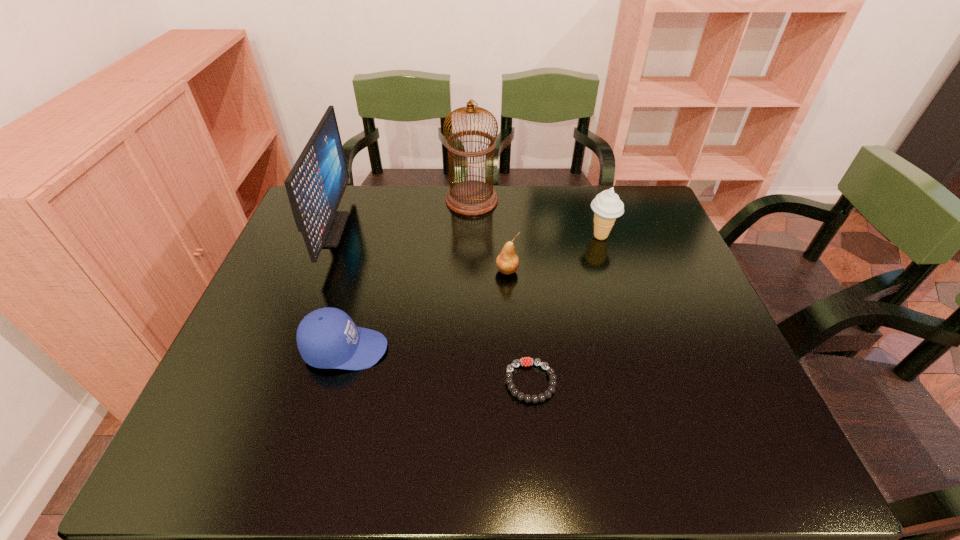
At what (x,y) coordinates should I click in order to perform the action: click on free location that satisfies the following two spatial constraints: 1. on the back side of the shortest object; 2. on the screen side of the leftmost object. Please return your answer as a coordinate pair (x, y). The width and height of the screenshot is (960, 540). Looking at the image, I should click on (516, 230).

Where is `free space that satisfies the following two spatial constraints: 1. on the front-facing side of the pear; 2. on the left side of the birdcage`? This screenshot has height=540, width=960. free space that satisfies the following two spatial constraints: 1. on the front-facing side of the pear; 2. on the left side of the birdcage is located at coordinates (470, 271).

You are a GUI agent. You are given a task and a screenshot of the screen. Output one action in this format:
    pyautogui.click(x=<x>, y=<y>)
    Task: Click on the vacant space that satisfies the following two spatial constraints: 1. on the screen side of the computer monitor; 2. on the back side of the third shortest object
    
    Given the screenshot: What is the action you would take?
    pyautogui.click(x=313, y=271)

Where is `free space that satisfies the following two spatial constraints: 1. on the screen side of the third shortest object; 2. on the right side of the leftmost object`? This screenshot has width=960, height=540. free space that satisfies the following two spatial constraints: 1. on the screen side of the third shortest object; 2. on the right side of the leftmost object is located at coordinates (313, 271).